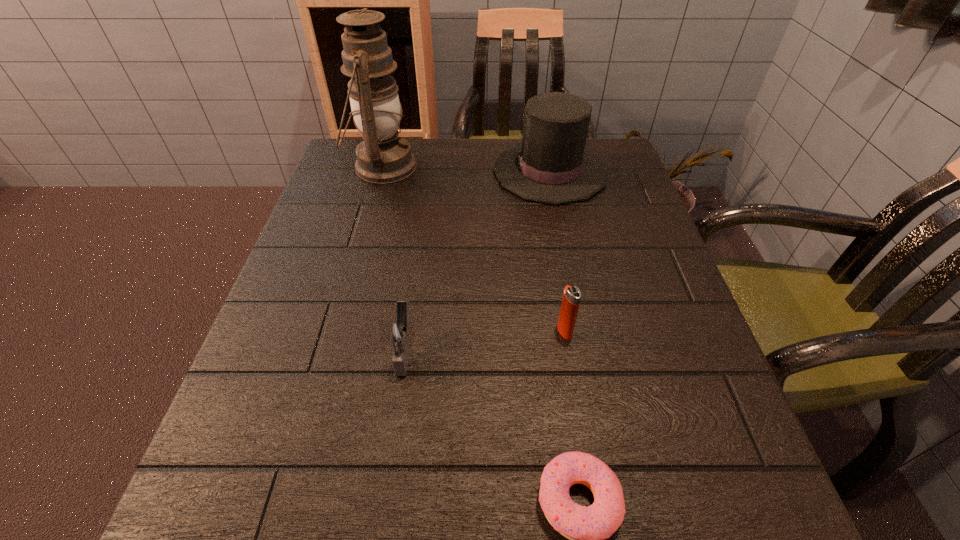
Identify the location of free point at the right edge. (627, 394).

Where is `vacant area between the tallest object and the fourth shortest object`? vacant area between the tallest object and the fourth shortest object is located at coordinates (467, 169).

This screenshot has height=540, width=960. In order to click on free space between the left igniter and the leftmost object in this screenshot , I will do `click(394, 258)`.

You are a GUI agent. You are given a task and a screenshot of the screen. Output one action in this format:
    pyautogui.click(x=<x>, y=<y>)
    Task: Click on the free space between the right igniter and the second tallest object
    The height and width of the screenshot is (540, 960).
    Given the screenshot: What is the action you would take?
    pyautogui.click(x=557, y=252)

Image resolution: width=960 pixels, height=540 pixels. Identify the location of free spot between the right igniter and the dress hat. (557, 252).

I want to click on free space between the dress hat and the right igniter, so click(x=557, y=252).

You are a GUI agent. You are given a task and a screenshot of the screen. Output one action in this format:
    pyautogui.click(x=<x>, y=<y>)
    Task: Click on the third closest object to the leftmost object
    
    Given the screenshot: What is the action you would take?
    pyautogui.click(x=572, y=296)

Locate which object is the closest to the leftmost object. Please provide its 2D coordinates. Your answer should be formatted as a tuple, i.e. [(x, y)], where the tuple contains the x and y coordinates of a point satisfying the conditions above.

[(551, 165)]

Where is `vacant space that satisfies the following two spatial constraints: 1. on the front of the second tallest object with the decoration; 2. on the front side of the left igniter`? This screenshot has width=960, height=540. vacant space that satisfies the following two spatial constraints: 1. on the front of the second tallest object with the decoration; 2. on the front side of the left igniter is located at coordinates (586, 350).

Image resolution: width=960 pixels, height=540 pixels. I want to click on vacant space that satisfies the following two spatial constraints: 1. on the front side of the right igniter; 2. on the left side of the leftmost object, so click(336, 331).